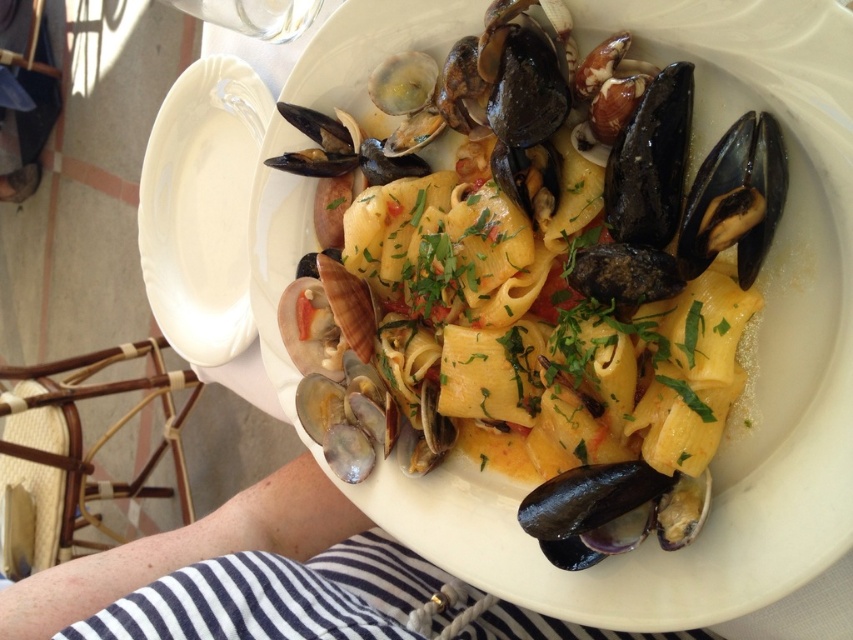
In the scene shown: You are a food critic inspecting a plate of seafood pasta. You notice the white glossy plate at upper left and the shiny dark blue shell at bottom right. Which object is positioned higher on the plate?

The white glossy plate at upper left is located above the shiny dark blue shell at bottom right, so it is positioned higher on the plate.